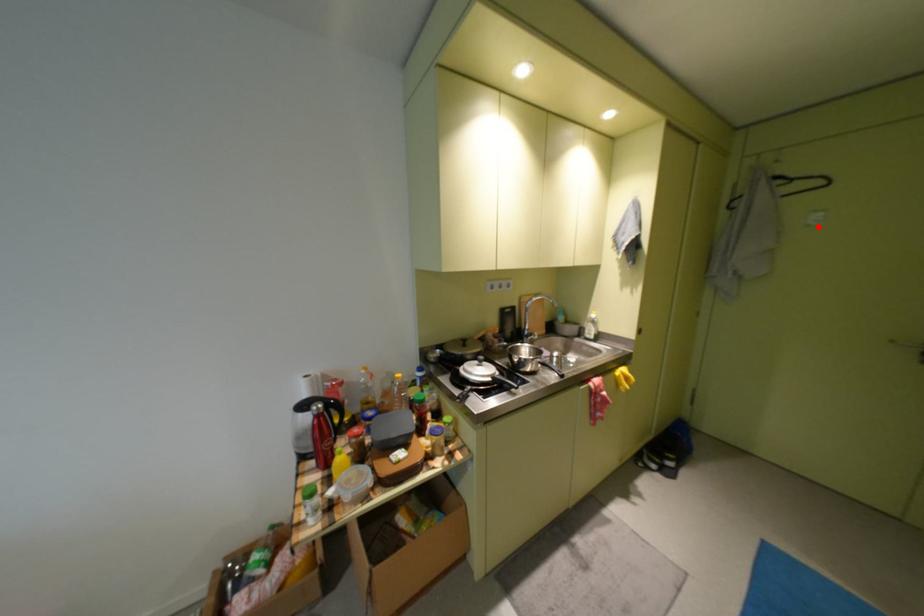
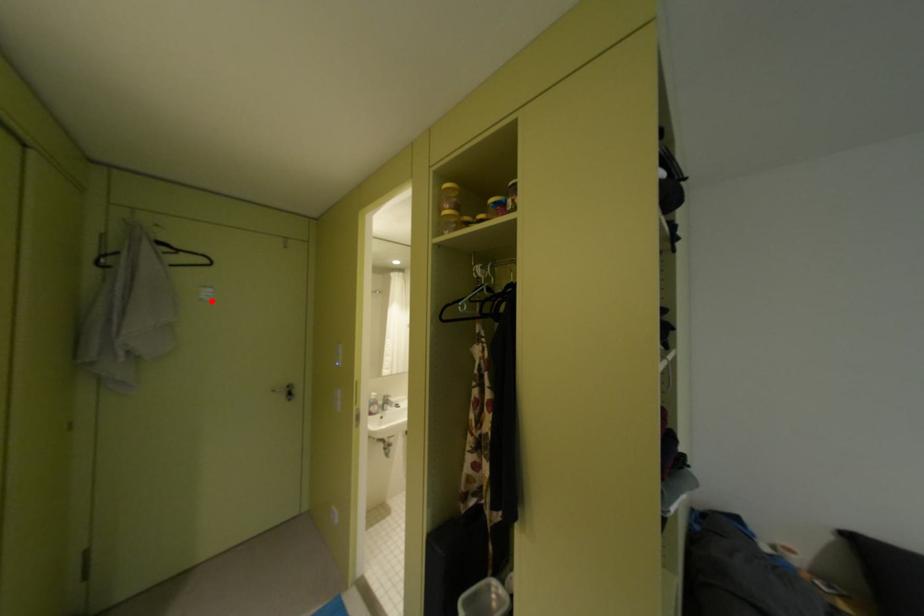
I am providing you with two images of the same scene from different viewpoints. A red point is marked on the first image and another point is marked on the second image. Does the point marked in image1 correspond to the same location as the one in image2?

Yes